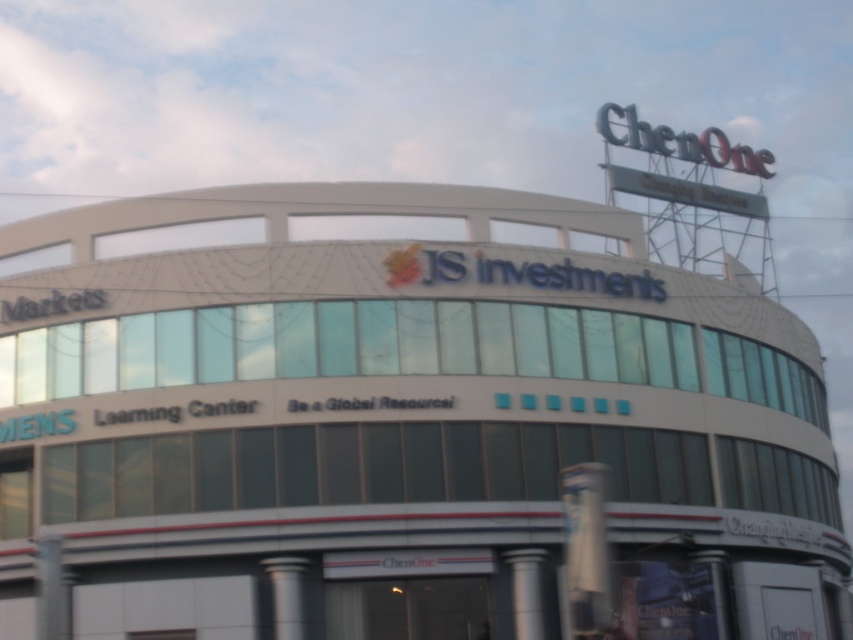
Does white glass building at center appear under silver metallic pillar at lower center?

Actually, white glass building at center is above silver metallic pillar at lower center.

Who is higher up, white glass building at center or silver metallic pillar at lower center?

white glass building at center

Which is behind, point (106, 564) or point (299, 624)?

The point (106, 564) is more distant.

Image resolution: width=853 pixels, height=640 pixels. Identify the location of white glass building at center. (396, 419).

Is the position of silver metallic pillar at center less distant than that of silver metallic pillar at lower center?

No, silver metallic pillar at center is further to the viewer.

Is silver metallic pillar at center taller than silver metallic pillar at lower center?

Correct, silver metallic pillar at center is much taller as silver metallic pillar at lower center.

Who is more distant from viewer, (529, 595) or (279, 595)?

Point (529, 595)

What are the coordinates of `silver metallic pillar at center` in the screenshot? It's located at (532, 593).

Is white glass building at center smaller than silver metallic pillar at center?

Incorrect, white glass building at center is not smaller in size than silver metallic pillar at center.

Based on the photo, which is more to the right, white glass building at center or silver metallic pillar at center?

white glass building at center is more to the right.

This screenshot has width=853, height=640. Find the location of `white glass building at center`. white glass building at center is located at coordinates (396, 419).